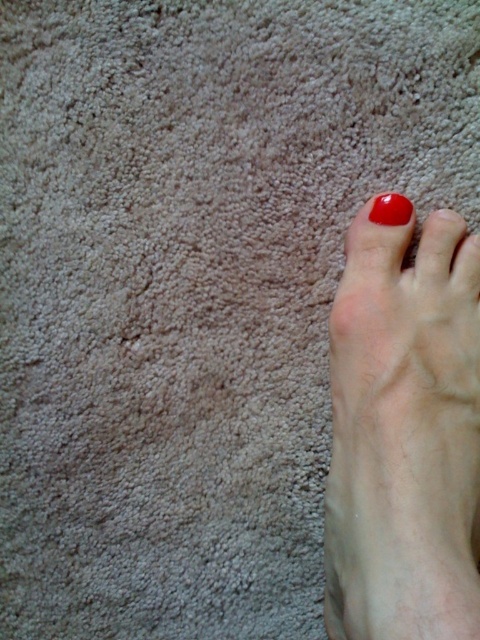
Question: Does smooth skin foot at lower right have a larger size compared to glossy red nail at upper right?

Choices:
 (A) yes
 (B) no

Answer: (A)

Question: Does smooth skin foot at lower right appear on the left side of glossy red nail at upper right?

Choices:
 (A) no
 (B) yes

Answer: (B)

Question: Is the position of smooth skin foot at lower right more distant than that of glossy red nail at upper right?

Choices:
 (A) yes
 (B) no

Answer: (B)